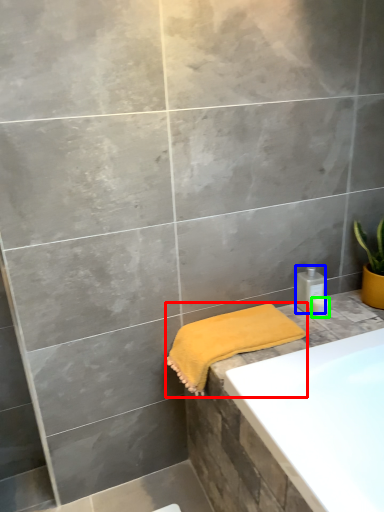
Question: Which object is the closest to the towel (highlighted by a red box)? Choose among these: toiletry (highlighted by a blue box) or toiletry (highlighted by a green box).

Choices:
 (A) toiletry
 (B) toiletry

Answer: (A)